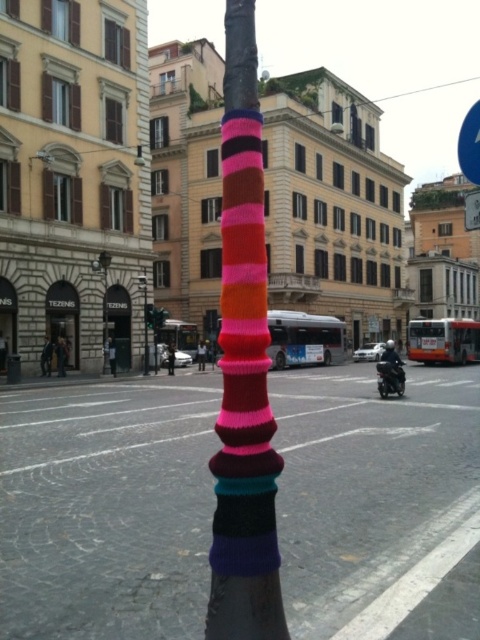
Question: Can you confirm if shiny black motorcycle at center is bigger than metallic silver lamp post at center?

Choices:
 (A) no
 (B) yes

Answer: (A)

Question: Is shiny black motorcycle at center wider than metallic silver lamp post at center?

Choices:
 (A) yes
 (B) no

Answer: (B)

Question: Among these points, which one is farthest from the camera?

Choices:
 (A) (104, 304)
 (B) (254, 481)
 (C) (144, 328)

Answer: (C)

Question: Does blue plastic street sign at upper right lie behind shiny black motorcycle at center?

Choices:
 (A) no
 (B) yes

Answer: (A)

Question: Among these objects, which one is farthest from the camera?

Choices:
 (A) knitted yarn pole at center
 (B) matte black lamp post at left

Answer: (B)

Question: Which point appears closest to the camera in this image?

Choices:
 (A) (237, 269)
 (B) (140, 275)
 (C) (381, 396)
 (D) (459, 134)

Answer: (A)